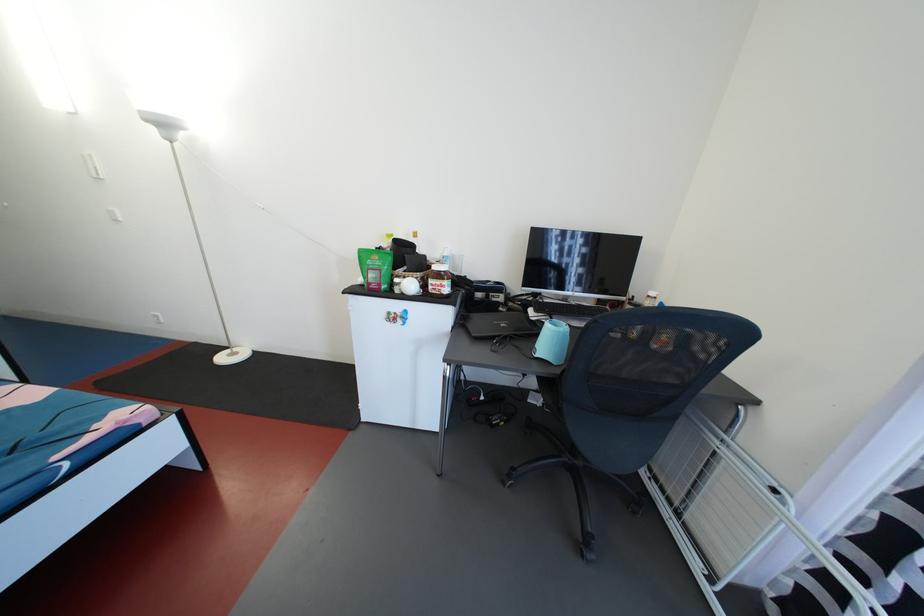
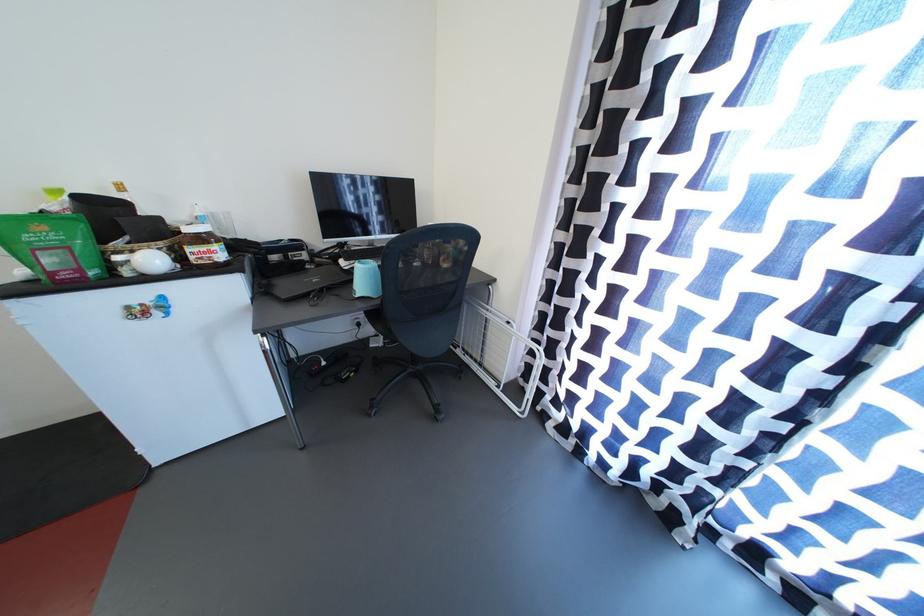
In the second image, find the point that corresponds to (x=542, y=318) in the first image.

(354, 268)